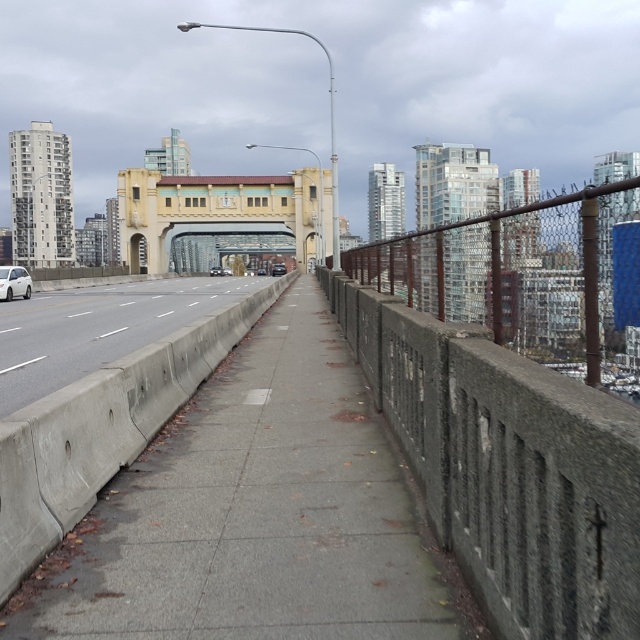
Question: Can you confirm if gray concrete sidewalk at center is positioned to the right of gray concrete highway at center?

Choices:
 (A) yes
 (B) no

Answer: (A)

Question: Which of the following is the farthest from the observer?

Choices:
 (A) (275, 275)
 (B) (54, 358)
 (C) (208, 227)
 (D) (16, 280)

Answer: (A)

Question: Where is gray concrete highway at center located in relation to white matte car at left in the image?

Choices:
 (A) below
 (B) above

Answer: (A)

Question: Which of the following is the farthest from the observer?

Choices:
 (A) white matte car at left
 (B) yellow matte bridge at center
 (C) gray concrete highway at center
 (D) gray concrete sidewalk at center

Answer: (B)

Question: Which point is farther from the camera taking this photo?

Choices:
 (A) (365, 477)
 (B) (16, 266)
 (C) (136, 291)
 (D) (166, 182)

Answer: (D)

Question: Is gray concrete sidewalk at center to the left of yellow matte bridge at center from the viewer's perspective?

Choices:
 (A) no
 (B) yes

Answer: (A)